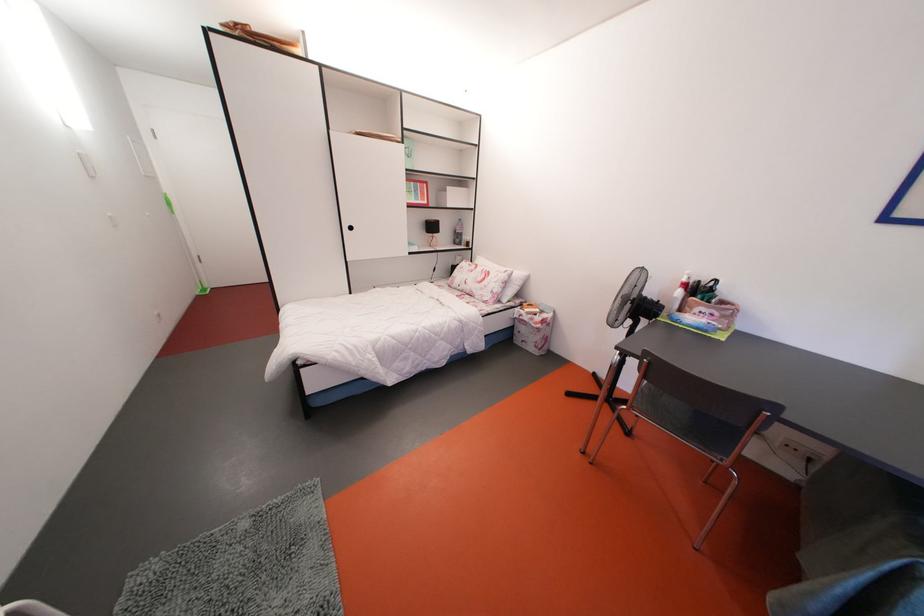
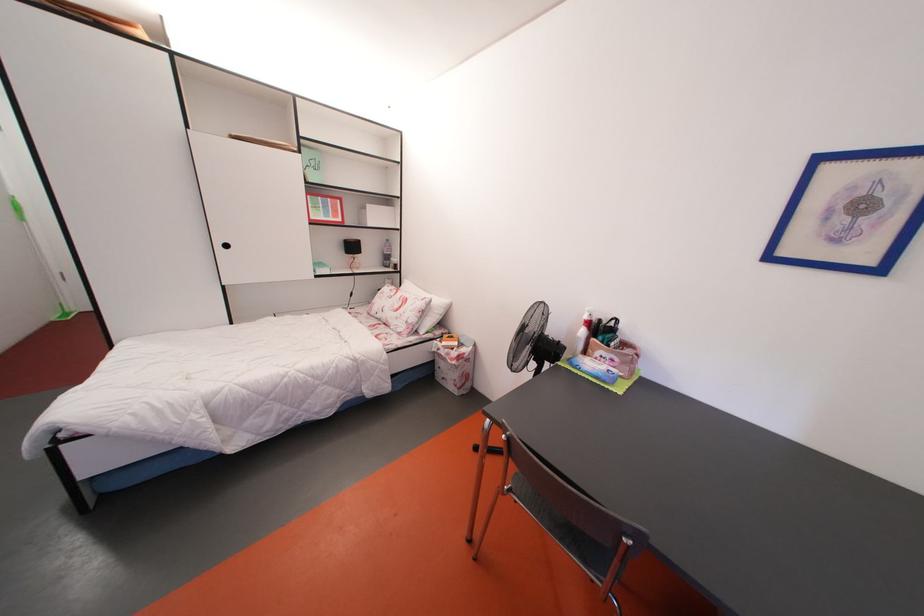
Locate, in the second image, the point that corresponds to the point at 533,325 in the first image.

(450, 360)